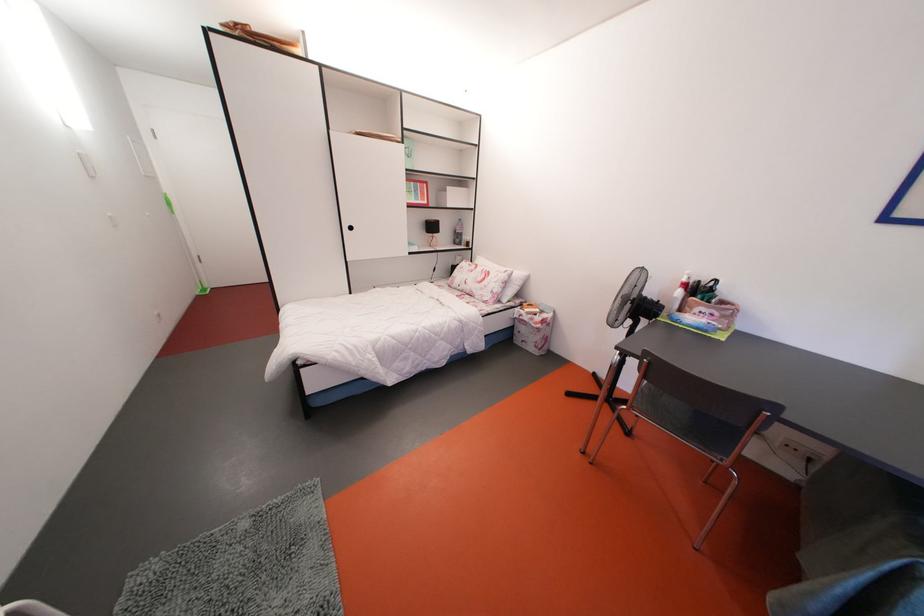
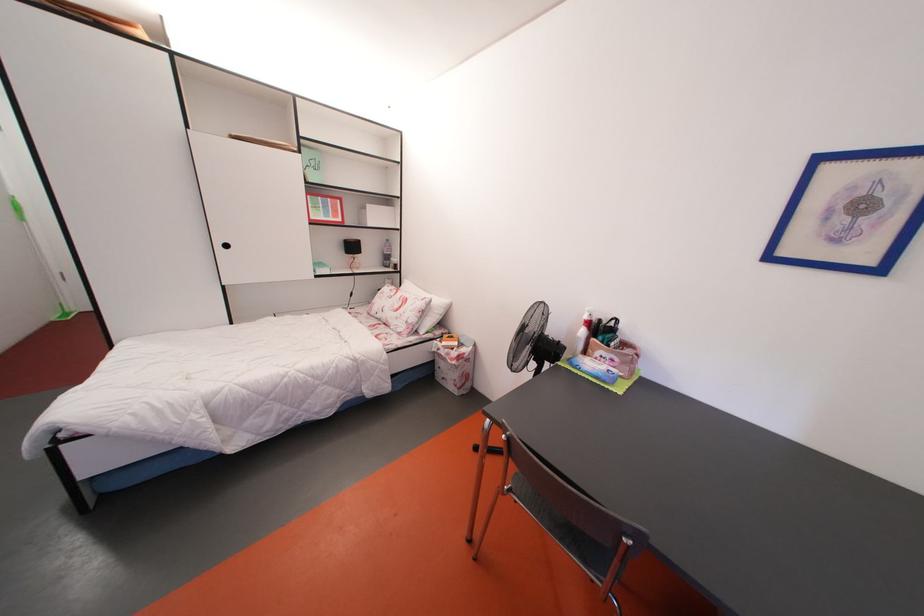
Locate, in the second image, the point that corresponds to the point at 533,325 in the first image.

(450, 360)